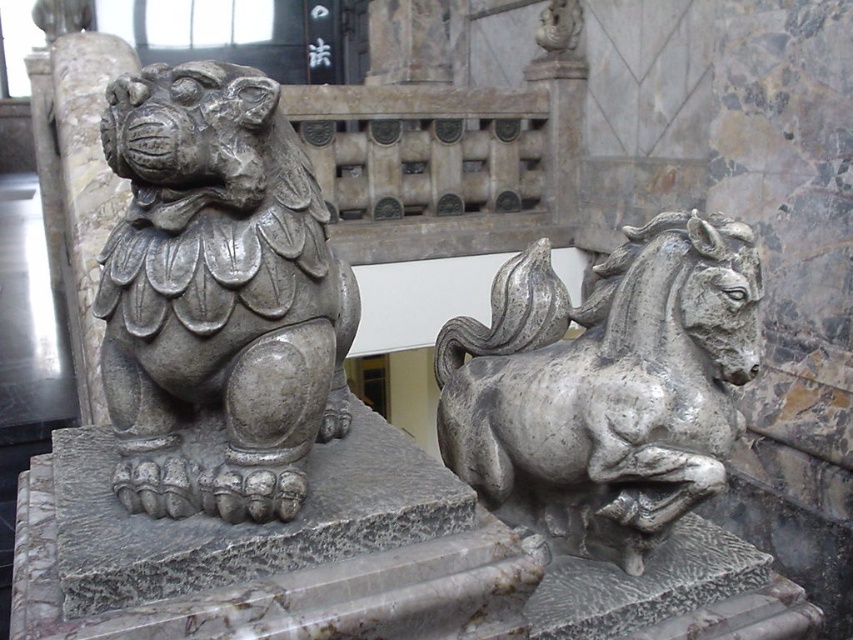
You are standing in front of two stone statues. You notice two points marked on the statues. One is at point (329,432) and the other is at point (741,314). Which point is closer to you?

Point (329,432) is closer to you because it is further to the viewer than point (741,314).

You are an artist planning to create a scale model of both the gray stone lion at left and the gray stone horse at right. If you want both models to be proportional to each other, which one should you make smaller?

You should make the gray stone lion at left smaller than the gray stone horse at right since the original gray stone lion at left is smaller than the gray stone horse at right.

You are standing in front of two statues, the gray stone lion at left and the gray stone horse at right. Which statue is positioned closer to you?

The gray stone lion at left is closer to the viewer than the gray stone horse at right.